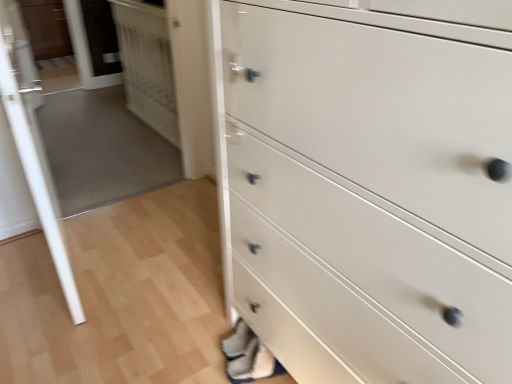
I want to click on free space underneath transparent glass door at left, which appears as the 2th glass door when viewed from the back (from a real-world perspective), so click(77, 259).